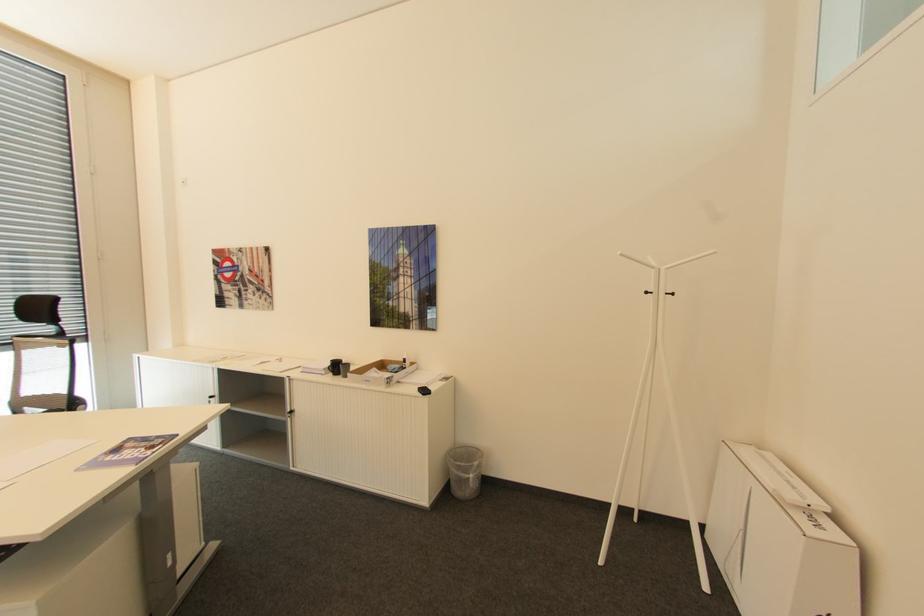
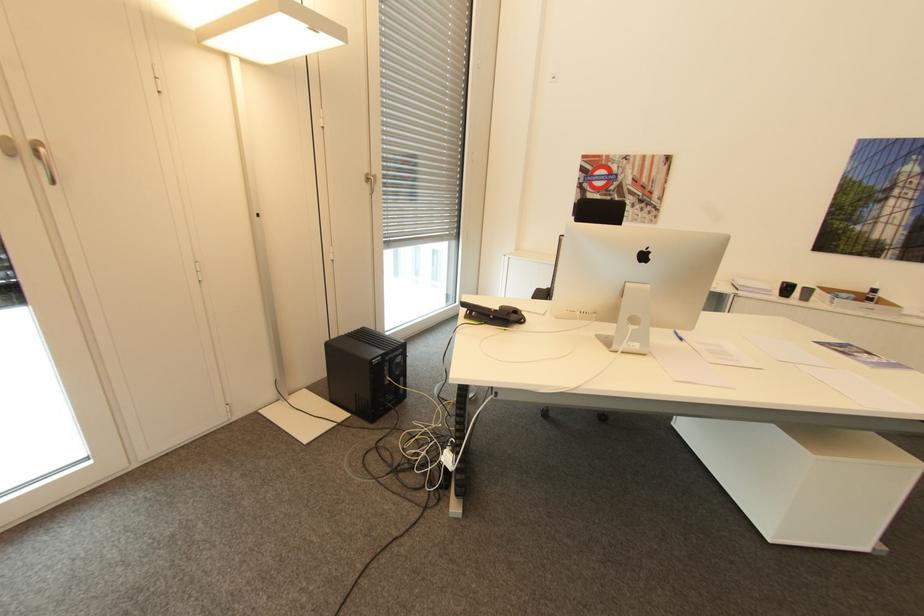
Where in the second image is the point corresponding to (408,360) from the first image?

(879, 290)